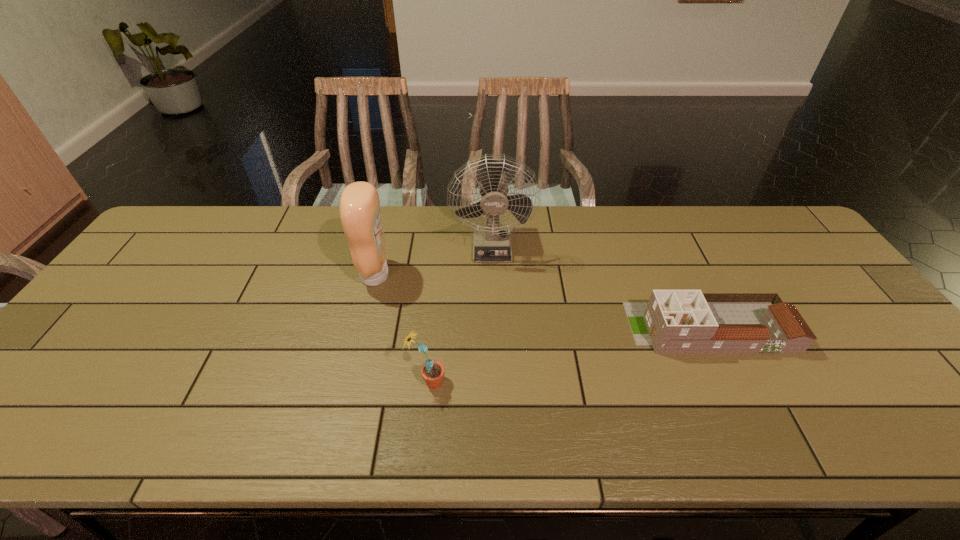
Identify the location of blank area located 0.140m at the main entrance of the dollhouse. (576, 327).

Locate an element on the screen. This screenshot has height=540, width=960. free spot located at the main entrance of the dollhouse is located at coordinates (568, 327).

Find the location of a particular element. This screenshot has height=540, width=960. vacant space located at the main entrance of the dollhouse is located at coordinates 484,327.

I want to click on object that is at the far edge, so click(x=491, y=244).

Where is `vacant area at the far edge of the desktop`? Image resolution: width=960 pixels, height=540 pixels. vacant area at the far edge of the desktop is located at coordinates (734, 233).

Where is `vacant space at the near edge of the desktop`? This screenshot has width=960, height=540. vacant space at the near edge of the desktop is located at coordinates (286, 436).

Image resolution: width=960 pixels, height=540 pixels. What are the coordinates of `free region at the left edge` in the screenshot? It's located at (149, 273).

The height and width of the screenshot is (540, 960). Find the location of `vacant region at the right edge of the desktop`. vacant region at the right edge of the desktop is located at coordinates (868, 343).

Where is `free space at the far left corner of the desktop`? The height and width of the screenshot is (540, 960). free space at the far left corner of the desktop is located at coordinates (164, 233).

In the image, there is a desktop. Identify the location of vacant space at the far right corner. (763, 244).